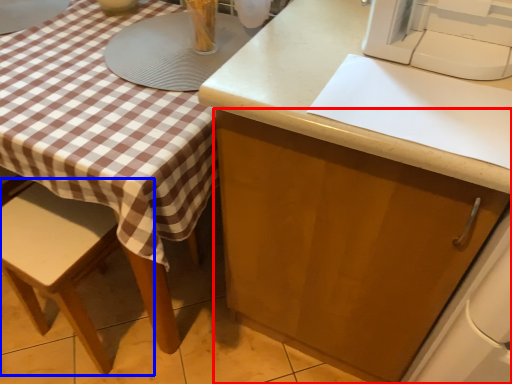
Question: Which of the following is the closest to the observer, cabinetry (highlighted by a red box) or chair (highlighted by a blue box)?

Choices:
 (A) cabinetry
 (B) chair

Answer: (A)